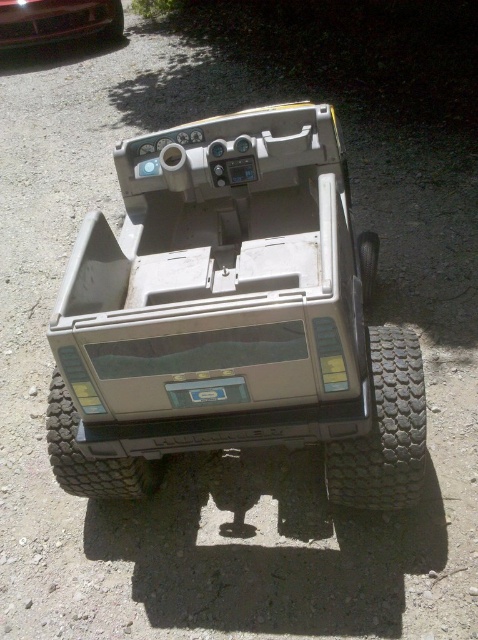
You are standing in front of the Hummer H1 and want to determine which of the two points, point (x=78, y=470) or point (x=370, y=288), is closer to you. Based on the scene, which point is nearer?

Point (x=78, y=470) is closer to the viewer than point (x=370, y=288).

You are a mechanic assessing the Hummer H1 for repairs. You notice the dark gray rugged tire at bottom center and the black rubber wheel at right. Which object has a greater height?

The dark gray rugged tire at bottom center is much taller than the black rubber wheel at right.

You are a drone operator trying to navigate between two points marked on the Hummer H1. The first point is at coordinate point(330, 496) and the second point is at coordinate point(61, 476). From the perspective of someone standing at the front of the vehicle, which point is closer to the front of the Hummer H1?

Point(330, 496) is in front of point(61, 476), so from the front of the Hummer H1, point(330, 496) is closer to the front.